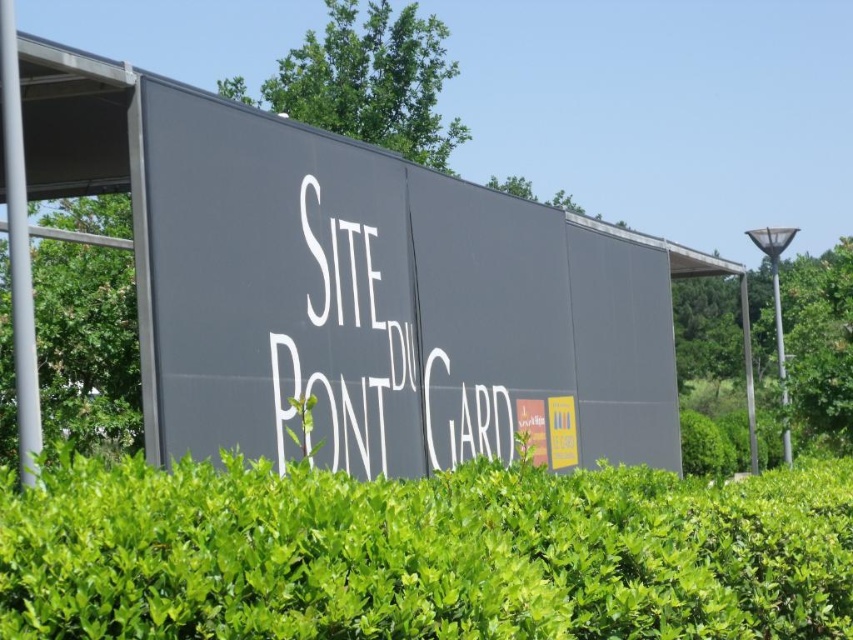
Does matte gray sign at center come behind green leafy hedge at center?

Yes, it is behind green leafy hedge at center.

Is point (173, 451) farther from camera compared to point (782, 580)?

That is True.

In order to click on matte gray sign at center in this screenshot , I will do pos(386,307).

Is green leafy hedge at center positioned at the back of green leafy bush at left?

No, it is in front of green leafy bush at left.

Can you confirm if green leafy hedge at center is positioned below green leafy bush at left?

Yes, green leafy hedge at center is below green leafy bush at left.

Who is more distant from viewer, (549,572) or (13,419)?

Positioned behind is point (13,419).

The image size is (853, 640). In order to click on green leafy hedge at center in this screenshot , I will do `click(422, 554)`.

Is point (270, 426) positioned after point (64, 371)?

No, it is not.

The height and width of the screenshot is (640, 853). Find the location of `matte gray sign at center`. matte gray sign at center is located at coordinates (386, 307).